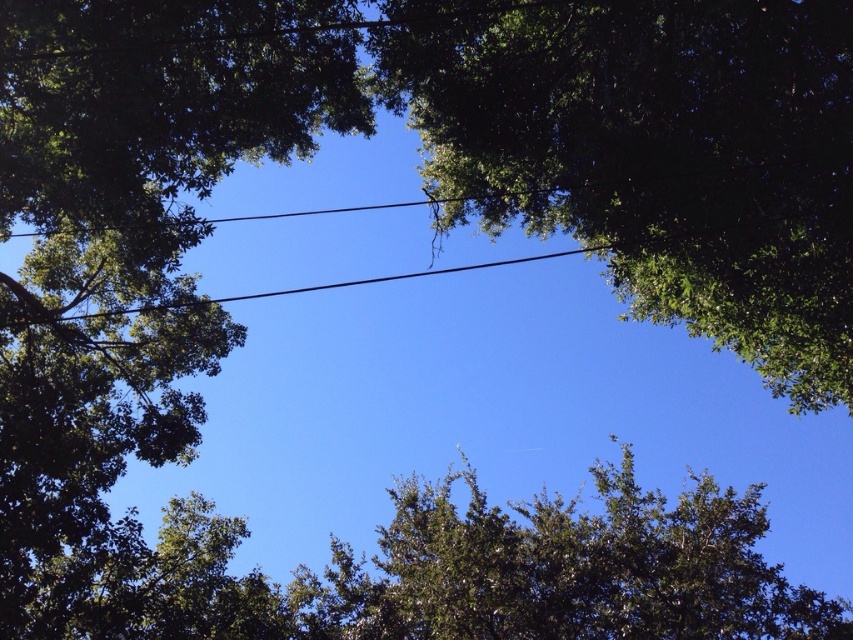
Question: Which of the following is the farthest from the observer?

Choices:
 (A) green leafy tree at center
 (B) green leafy tree at upper center

Answer: (A)

Question: Does green leafy tree at upper center have a lesser width compared to green leafy tree at center?

Choices:
 (A) yes
 (B) no

Answer: (A)

Question: Among these objects, which one is nearest to the camera?

Choices:
 (A) green leafy tree at center
 (B) green leafy tree at upper center

Answer: (B)

Question: From the image, what is the correct spatial relationship of green leafy tree at upper center in relation to green leafy tree at center?

Choices:
 (A) left
 (B) right

Answer: (A)

Question: Where is green leafy tree at upper center located in relation to green leafy tree at center in the image?

Choices:
 (A) above
 (B) below

Answer: (A)

Question: Which of the following is the closest to the observer?

Choices:
 (A) (717, 499)
 (B) (640, 99)

Answer: (B)